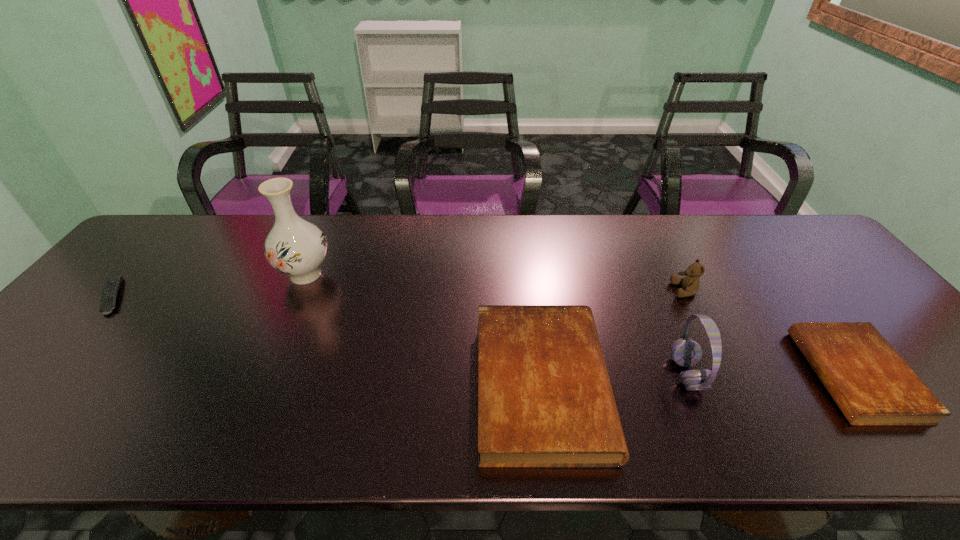
Image resolution: width=960 pixels, height=540 pixels. Identify the location of the fifth shortest object. (685, 352).

At what (x,y) coordinates should I click in order to perform the action: click on the fourth object from left to right. Please return your answer as a coordinate pair (x, y). Looking at the image, I should click on (685, 352).

What are the coordinates of `free space located 0.360m on the spine side of the fourth tallest object` in the screenshot? It's located at (765, 385).

Image resolution: width=960 pixels, height=540 pixels. What are the coordinates of `free space located 0.200m on the spine side of the shorter Bible` in the screenshot? It's located at (726, 376).

Locate an element on the screen. Image resolution: width=960 pixels, height=540 pixels. vacant space located 0.270m on the spine side of the shorter Bible is located at coordinates (695, 376).

Where is `vacant space positioned 0.050m on the spine side of the shorter Bible`? vacant space positioned 0.050m on the spine side of the shorter Bible is located at coordinates (791, 376).

Locate an element on the screen. free space located 0.110m on the back of the tallest object is located at coordinates (324, 234).

I want to click on vacant region located on the right of the shortest object, so click(217, 296).

The width and height of the screenshot is (960, 540). Find the location of `free spot located on the front-facing side of the fourth shortest object`. free spot located on the front-facing side of the fourth shortest object is located at coordinates (611, 290).

The image size is (960, 540). I want to click on free space located 0.220m on the front-facing side of the fourth shortest object, so click(592, 290).